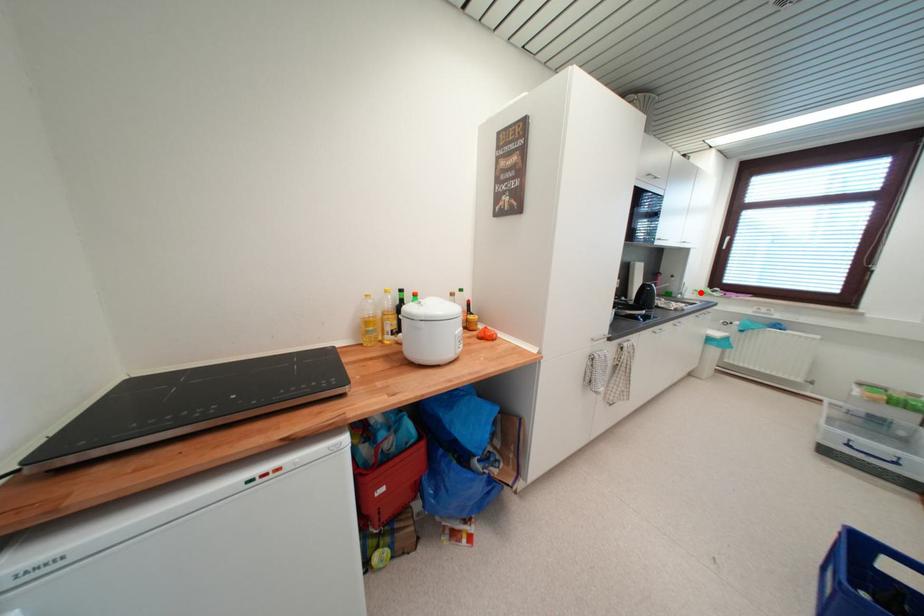
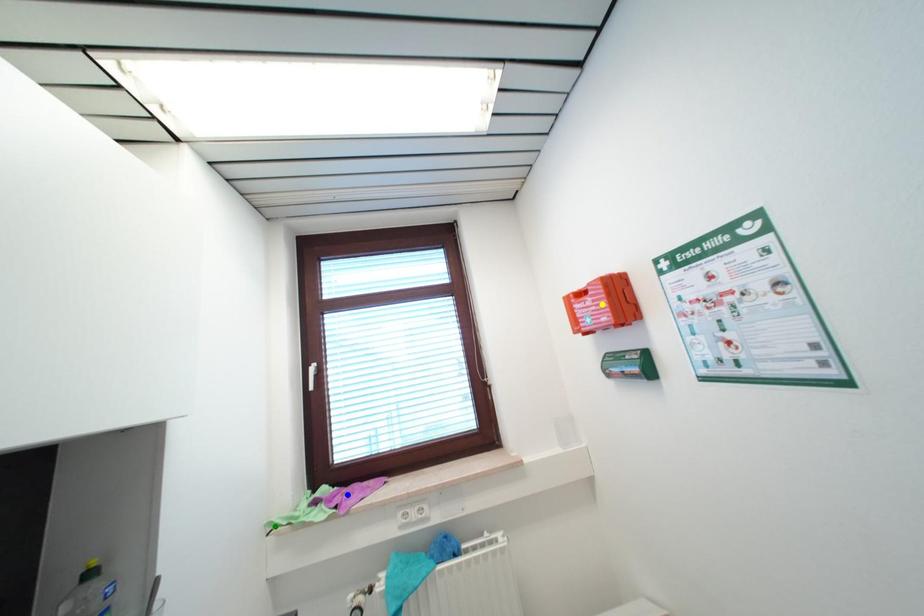
Question: I am providing you with two images of the same scene from different viewpoints. A red point is marked on the first image. You are given multiple points on the second image. Which spot in image 2 lines up with the point in image 1?

Choices:
 (A) yellow point
 (B) blue point
 (C) green point

Answer: (C)